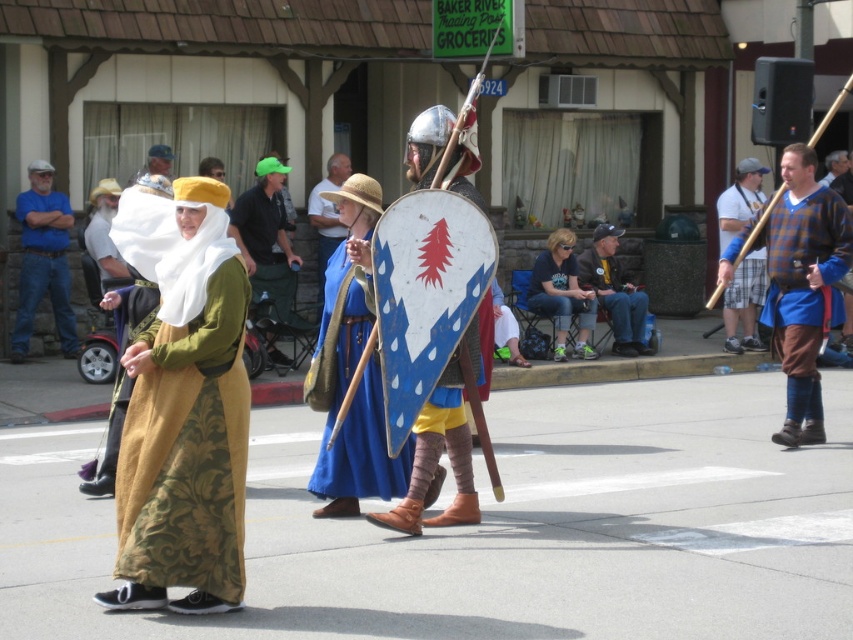
Question: Can you confirm if blue fabric shield at center is positioned to the left of dark blue leather jacket at center?

Choices:
 (A) yes
 (B) no

Answer: (A)

Question: Is green fabric hat at center to the right of wooden shield at center from the viewer's perspective?

Choices:
 (A) yes
 (B) no

Answer: (B)

Question: Which object is closer to the camera taking this photo?

Choices:
 (A) wooden shield at center
 (B) blue denim jeans at left
 (C) matte gold fabric dress at center

Answer: (C)

Question: Which is nearer to the blue denim jeans at left?

Choices:
 (A) green fabric hat at center
 (B) blue plaid shirt at center
 (C) matte gold fabric dress at center

Answer: (A)

Question: Which point is farther to the camera?

Choices:
 (A) (787, 390)
 (B) (169, 172)

Answer: (B)

Question: From the image, what is the correct spatial relationship of matte gold fabric dress at center in relation to dark blue t-shirt at center?

Choices:
 (A) below
 (B) above

Answer: (A)